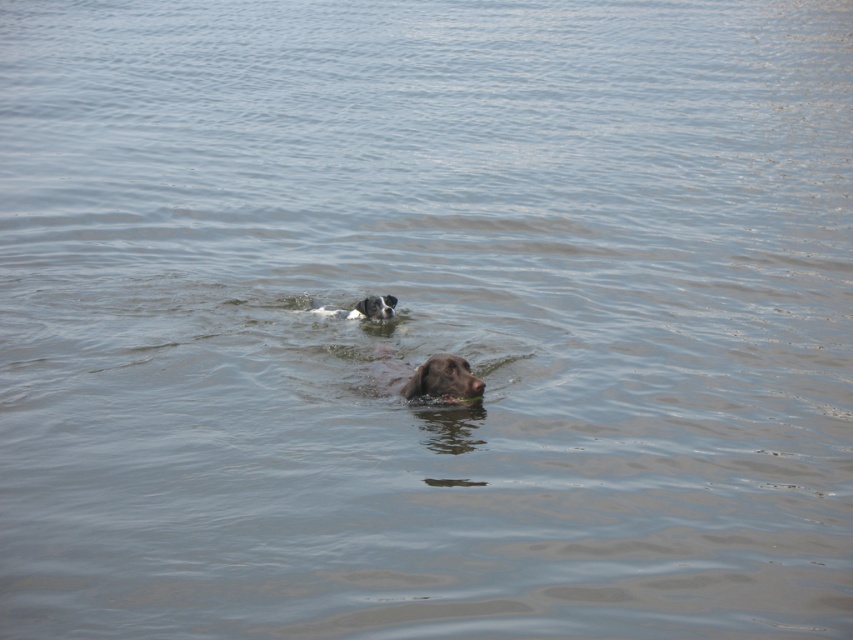
Which is behind, point (456, 392) or point (358, 307)?

The point (358, 307) is more distant.

Between point (434, 385) and point (380, 301), which one is positioned in front?

Positioned in front is point (434, 385).

Locate an element on the screen. brown matte dog at center is located at coordinates (425, 378).

This screenshot has width=853, height=640. Identify the location of brown matte dog at center. (425, 378).